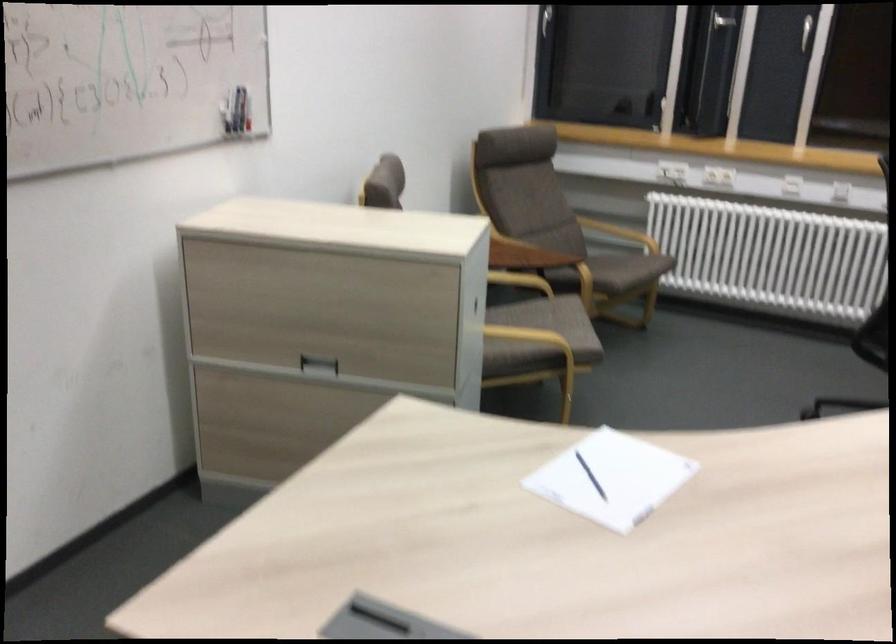
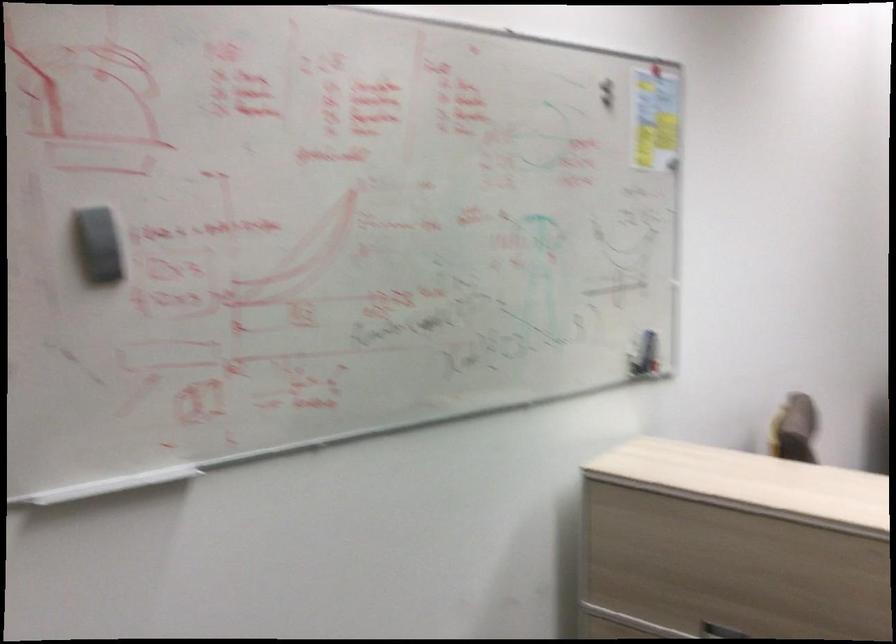
Question: Based on the continuous images, in which direction is the camera rotating? Reply with the corresponding letter.

Choices:
 (A) Left
 (B) Right
 (C) Up
 (D) Down

Answer: (A)